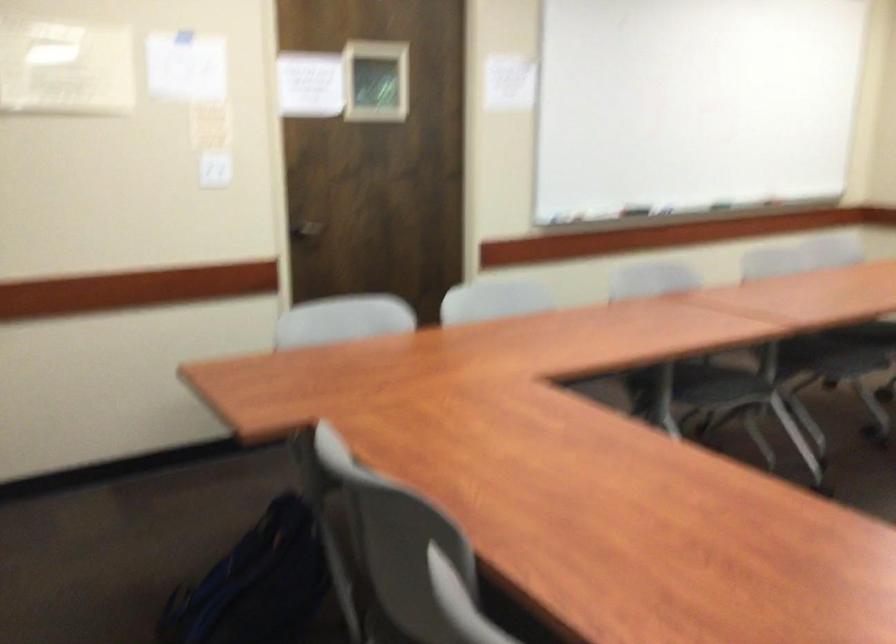
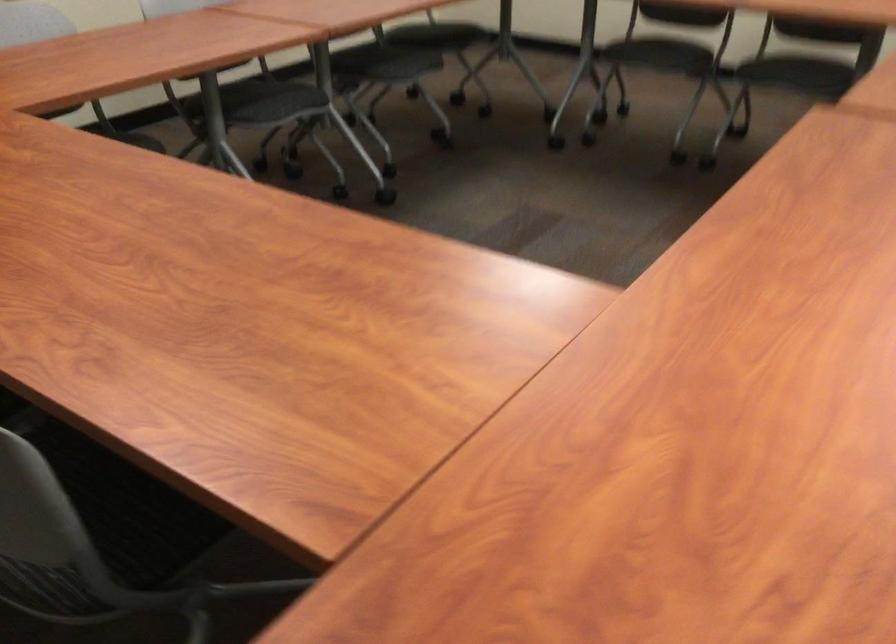
The images are taken continuously from a first-person perspective. In which direction is your viewpoint rotating?

The camera rotated toward right-down.